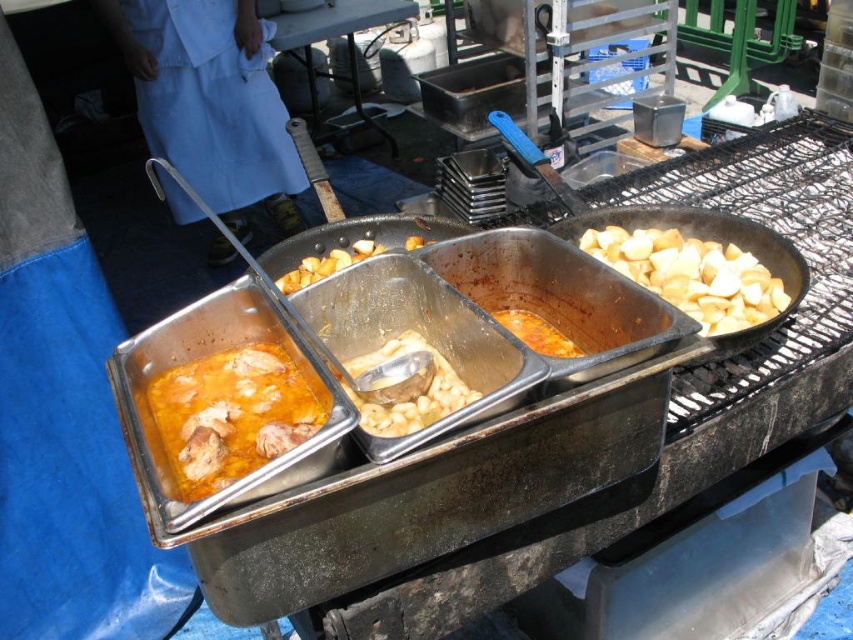
Can you confirm if golden brown potato at center is wider than orange matte stew at center?

Indeed, golden brown potato at center has a greater width compared to orange matte stew at center.

Does golden brown potato at center have a smaller size compared to orange matte stew at center?

No.

Between point (337, 260) and point (570, 348), which one is positioned in front?

Point (570, 348) is more forward.

Image resolution: width=853 pixels, height=640 pixels. In order to click on golden brown potato at center in this screenshot , I will do `click(326, 264)`.

Based on the photo, which of these two, yellowish matte potatoes at right or golden brown potato at center, stands taller?

yellowish matte potatoes at right

Where is `yellowish matte potatoes at right`? This screenshot has width=853, height=640. yellowish matte potatoes at right is located at coordinates (692, 275).

Who is more distant from viewer, (x=701, y=298) or (x=283, y=291)?

The point (x=283, y=291) is more distant.

What are the coordinates of `yellowish matte potatoes at right` in the screenshot? It's located at (692, 275).

Is white matte beans at center bigger than golden brown potato at center?

Correct, white matte beans at center is larger in size than golden brown potato at center.

Is white matte beans at center wider than golden brown potato at center?

Incorrect, white matte beans at center's width does not surpass golden brown potato at center's.

At what (x,y) coordinates should I click in order to perform the action: click on white matte beans at center. Please return your answer as a coordinate pair (x, y). Image resolution: width=853 pixels, height=640 pixels. Looking at the image, I should click on (413, 397).